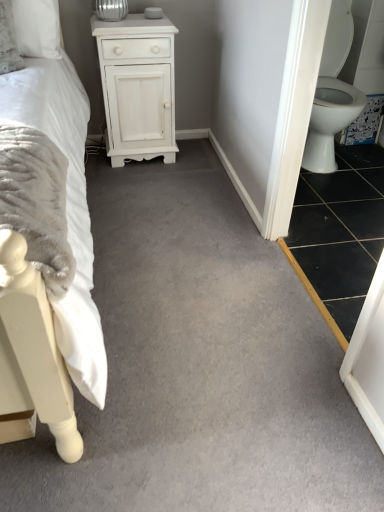
Question: Considering the relative sizes of white soft bed at left and white glossy toilet at right in the image provided, is white soft bed at left wider than white glossy toilet at right?

Choices:
 (A) no
 (B) yes

Answer: (B)

Question: Can you confirm if white soft bed at left is positioned to the left of white glossy toilet at right?

Choices:
 (A) no
 (B) yes

Answer: (B)

Question: Does white soft bed at left have a greater height compared to white glossy toilet at right?

Choices:
 (A) yes
 (B) no

Answer: (A)

Question: Is white soft bed at left positioned far away from white glossy toilet at right?

Choices:
 (A) no
 (B) yes

Answer: (B)

Question: Can you confirm if white soft bed at left is smaller than white glossy toilet at right?

Choices:
 (A) no
 (B) yes

Answer: (A)

Question: Is point tap(3, 381) positioned closer to the camera than point tap(334, 173)?

Choices:
 (A) closer
 (B) farther

Answer: (A)

Question: Looking at their shapes, would you say white soft bed at left is wider or thinner than black tile at lower right?

Choices:
 (A) wide
 (B) thin

Answer: (A)

Question: In the image, is white soft bed at left on the left side or the right side of black tile at lower right?

Choices:
 (A) left
 (B) right

Answer: (A)

Question: Based on their sizes in the image, would you say white soft bed at left is bigger or smaller than black tile at lower right?

Choices:
 (A) big
 (B) small

Answer: (A)

Question: Which is correct: white glossy toilet at right is inside black tile at lower right, or outside of it?

Choices:
 (A) outside
 (B) inside

Answer: (A)

Question: Is white glossy toilet at right to the left or to the right of black tile at lower right in the image?

Choices:
 (A) left
 (B) right

Answer: (A)

Question: Is white glossy toilet at right in front of or behind black tile at lower right in the image?

Choices:
 (A) front
 (B) behind

Answer: (B)

Question: Is point (337, 114) positioned closer to the camera than point (301, 178)?

Choices:
 (A) closer
 (B) farther

Answer: (A)

Question: In the image, is white matte cabinet at upper center positioned in front of or behind black tile at lower right?

Choices:
 (A) front
 (B) behind

Answer: (B)

Question: Is white matte cabinet at upper center to the left or to the right of black tile at lower right in the image?

Choices:
 (A) right
 (B) left

Answer: (B)